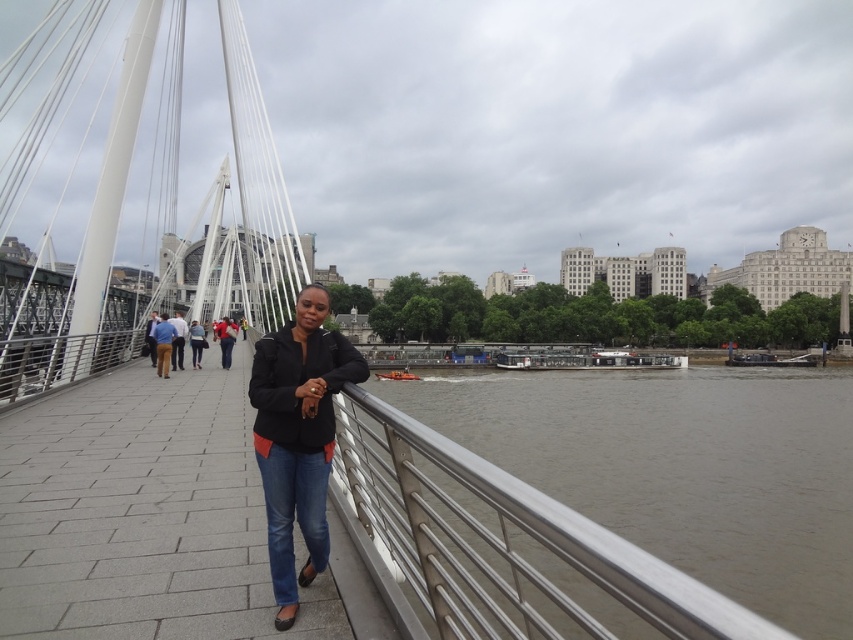
Question: Where is silver metallic railing at center located in relation to light brown leather jacket at center in the image?

Choices:
 (A) below
 (B) above

Answer: (A)

Question: Considering the relative positions of blue cotton shirt at center and denim jacket at center in the image provided, where is blue cotton shirt at center located with respect to denim jacket at center?

Choices:
 (A) left
 (B) right

Answer: (A)

Question: Estimate the real-world distances between objects in this image. Which object is closer to the denim jacket at center?

Choices:
 (A) light brown leather jacket at center
 (B) blue jeans at center

Answer: (A)

Question: Among these points, which one is farthest from the camera?

Choices:
 (A) (311, 291)
 (B) (387, 442)
 (C) (161, 332)

Answer: (C)

Question: Among these objects, which one is nearest to the camera?

Choices:
 (A) matte black jacket at center
 (B) silver metallic railing at center

Answer: (B)

Question: Does matte black jacket at center appear over black matte jacket at center?

Choices:
 (A) no
 (B) yes

Answer: (A)